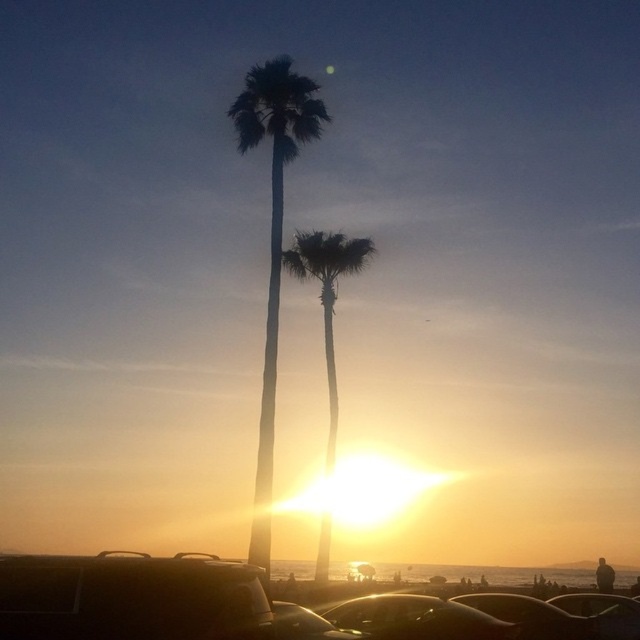
Between silky smooth palm tree at center and metallic silver car at lower center, which one appears on the right side from the viewer's perspective?

Positioned to the right is metallic silver car at lower center.

Looking at this image, who is lower down, silky smooth palm tree at center or metallic silver car at lower center?

metallic silver car at lower center is below.

Is point (273, 122) farther from camera compared to point (522, 598)?

Yes, point (273, 122) is behind point (522, 598).

Locate an element on the screen. silky smooth palm tree at center is located at coordinates (273, 236).

Describe the element at coordinates (273, 236) in the screenshot. The width and height of the screenshot is (640, 640). I see `silky smooth palm tree at center` at that location.

Can you confirm if silky smooth palm tree at center is bigger than glossy metallic car at center?

Correct, silky smooth palm tree at center is larger in size than glossy metallic car at center.

Describe the element at coordinates (273, 236) in the screenshot. I see `silky smooth palm tree at center` at that location.

You are a GUI agent. You are given a task and a screenshot of the screen. Output one action in this format:
    pyautogui.click(x=<x>, y=<y>)
    Task: Click on the silky smooth palm tree at center
    This screenshot has width=640, height=640.
    Given the screenshot: What is the action you would take?
    pyautogui.click(x=273, y=236)

Is silky smooth palm tree at center to the left of shiny metallic car at lower center from the viewer's perspective?

Indeed, silky smooth palm tree at center is positioned on the left side of shiny metallic car at lower center.

Can you confirm if silky smooth palm tree at center is positioned above shiny metallic car at lower center?

Indeed, silky smooth palm tree at center is positioned over shiny metallic car at lower center.

Which is in front, point (259, 483) or point (324, 637)?

Positioned in front is point (324, 637).

Where is `silky smooth palm tree at center`? The image size is (640, 640). silky smooth palm tree at center is located at coordinates (273, 236).